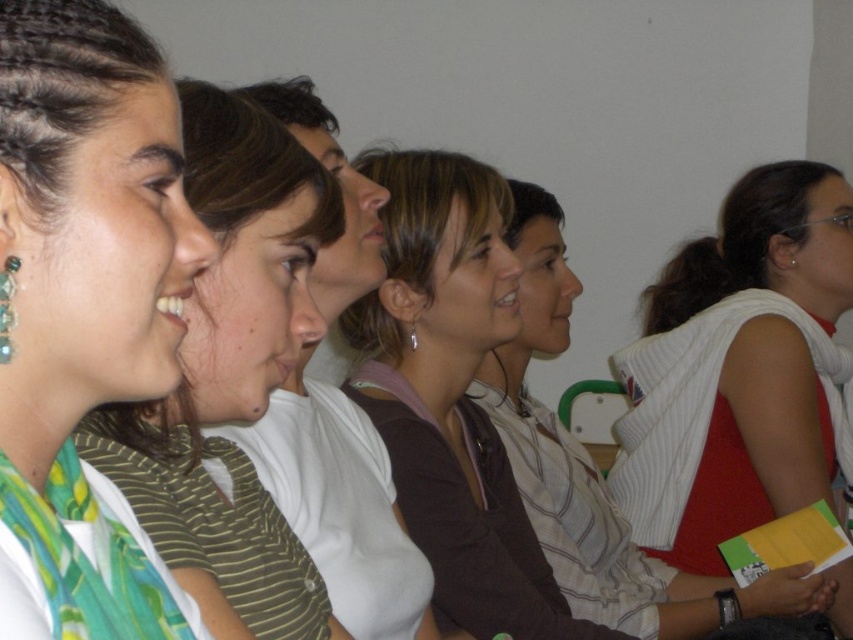
You are organizing a clothing donation drive and need to determine which item takes up less space between the green silk scarf at left and the green striped shirt at left. Which item should you choose?

The green silk scarf at left is smaller than the green striped shirt at left, so it takes up less space and should be chosen.

Consider the image. You are standing in the room and want to reach the point marked as point (775,483). If you take a step forward of 1.5 meters, will you be able to reach it?

The point (775,483) is 2.02 meters away from the viewer. Taking a step forward of 1.5 meters would bring you to 0.52 meters away from the point, so yes, you can reach it.